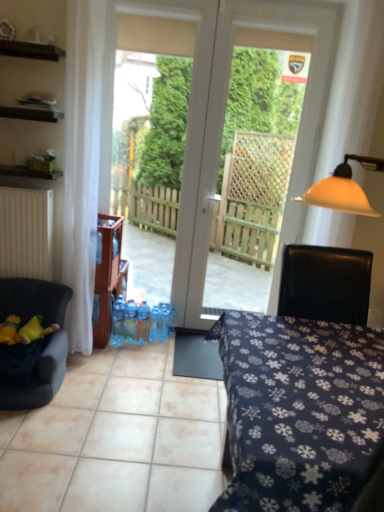
This screenshot has width=384, height=512. Find the location of `vacant area located to the right-hand side of blue plastic bottle at center, which ranks as the fifth bottle in left-to-right order`. vacant area located to the right-hand side of blue plastic bottle at center, which ranks as the fifth bottle in left-to-right order is located at coordinates (185, 339).